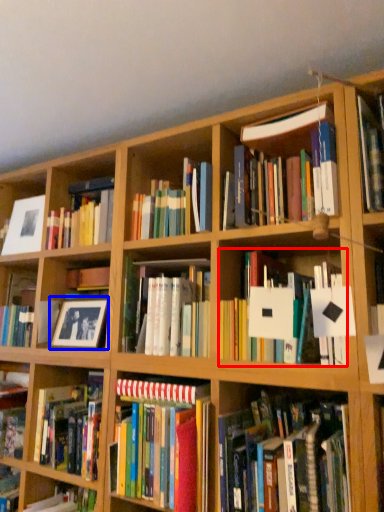
Question: Among these objects, which one is farthest to the camera, book (highlighted by a red box) or picture frame (highlighted by a blue box)?

Choices:
 (A) book
 (B) picture frame

Answer: (B)